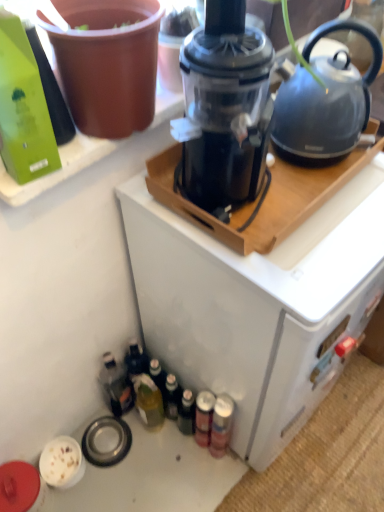
This screenshot has width=384, height=512. Identify the location of unoccupied area in front of translucent glass bottle at lower left, which ranks as the first bottle in bottom-to-top order. (152, 471).